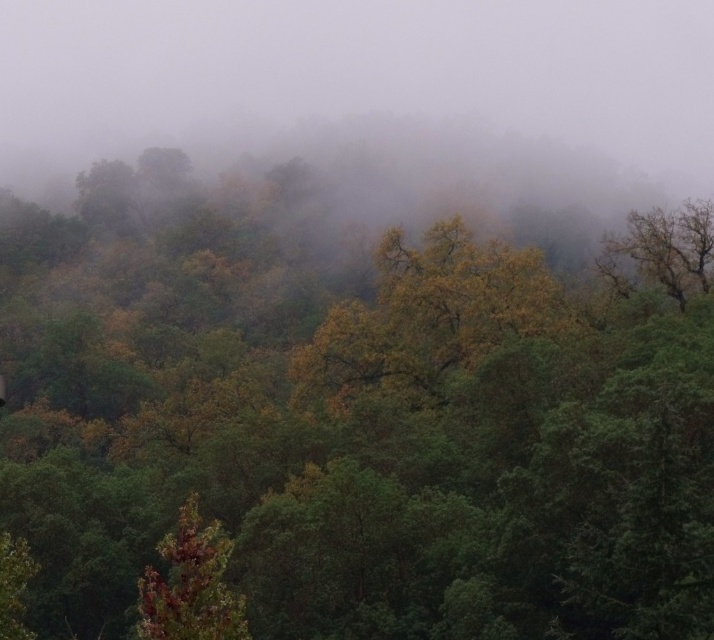
Question: Based on their relative distances, which object is nearer to the brown matte tree at lower left?

Choices:
 (A) green leafy tree at upper right
 (B) foggy atmosphere at center

Answer: (A)

Question: Can you confirm if foggy atmosphere at center is positioned below green leafy tree at upper right?

Choices:
 (A) no
 (B) yes

Answer: (A)

Question: Which object is farther from the camera taking this photo?

Choices:
 (A) brown matte tree at lower left
 (B) green leafy tree at upper right

Answer: (B)

Question: Does brown matte tree at lower left come behind green leafy tree at upper right?

Choices:
 (A) yes
 (B) no

Answer: (B)

Question: Is foggy atmosphere at center below brown matte tree at lower left?

Choices:
 (A) yes
 (B) no

Answer: (B)

Question: Among these points, which one is farthest from the camera?

Choices:
 (A) (238, 627)
 (B) (618, 248)

Answer: (B)